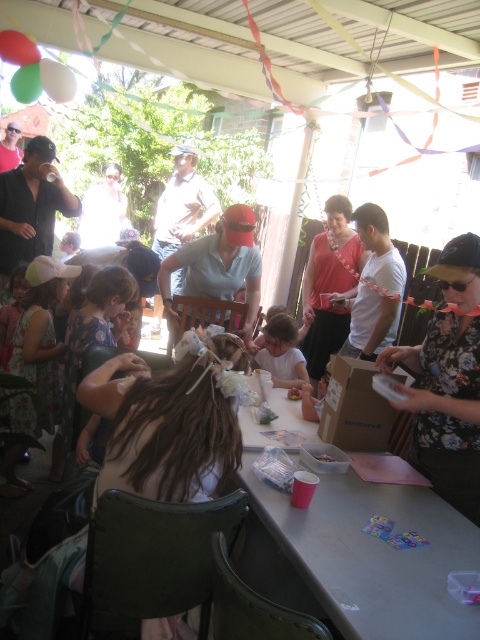
Question: Which point is farther to the camera?

Choices:
 (A) light blue shirt at center
 (B) gray plastic table at center

Answer: (A)

Question: Is gray plastic table at center above light blue shirt at center?

Choices:
 (A) yes
 (B) no

Answer: (B)

Question: Which point appears farthest from the camera in this image?

Choices:
 (A) (379, 506)
 (B) (269, 332)

Answer: (B)

Question: Is gray plastic table at center wider than light blue shirt at center?

Choices:
 (A) yes
 (B) no

Answer: (A)

Question: Does gray plastic table at center lie behind light blue shirt at center?

Choices:
 (A) no
 (B) yes

Answer: (A)